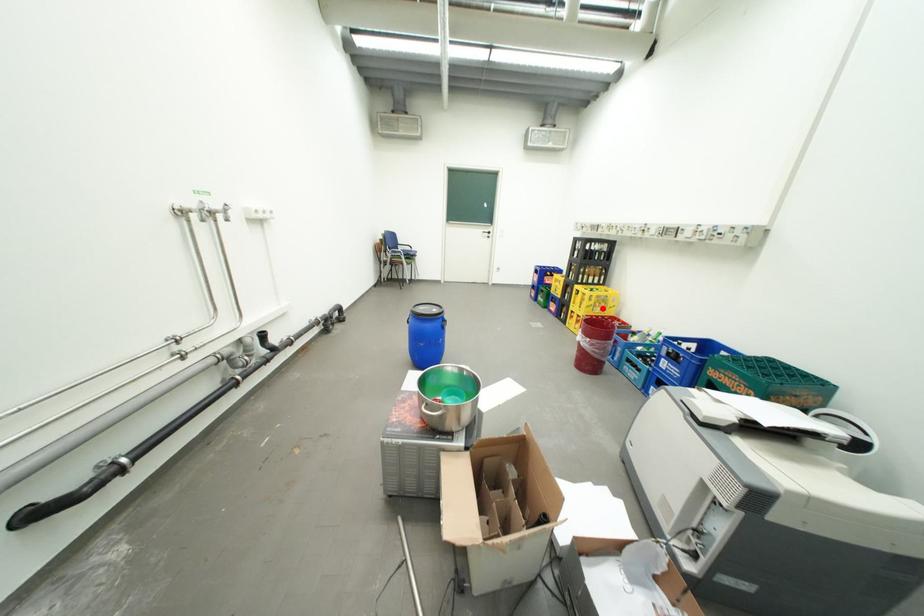
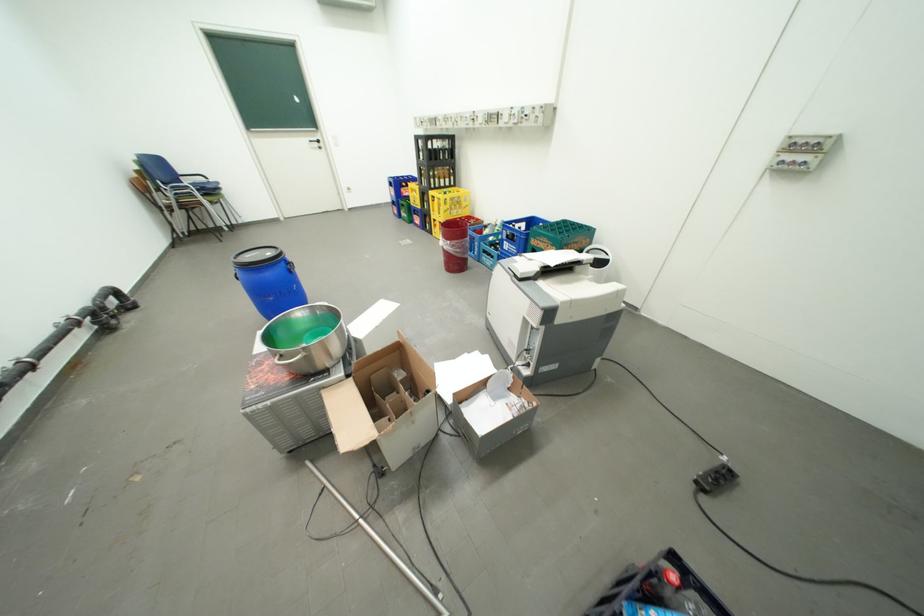
Question: I am providing you with two images of the same scene from different viewpoints. Given a red point in image1, look at the same physical point in image2. Is it:

Choices:
 (A) Closer to the viewpoint
 (B) Farther from the viewpoint

Answer: (B)